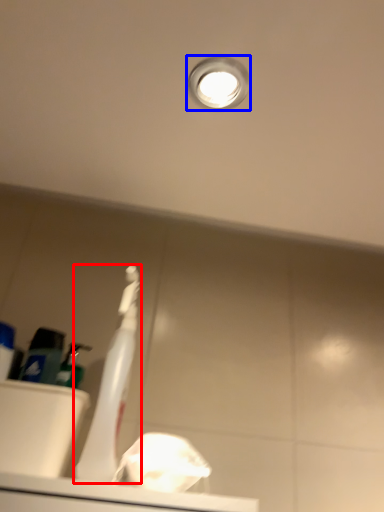
Question: Which object appears farthest to the camera in this image, toothbrush (highlighted by a red box) or droplight (highlighted by a blue box)?

Choices:
 (A) toothbrush
 (B) droplight

Answer: (B)